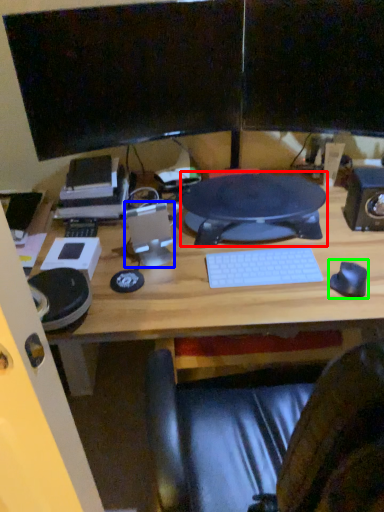
Question: Estimate the real-world distances between objects in this image. Which object is farther from sit (highlighted by a red box), speaker (highlighted by a blue box) or mouse (highlighted by a green box)?

Choices:
 (A) speaker
 (B) mouse

Answer: (B)